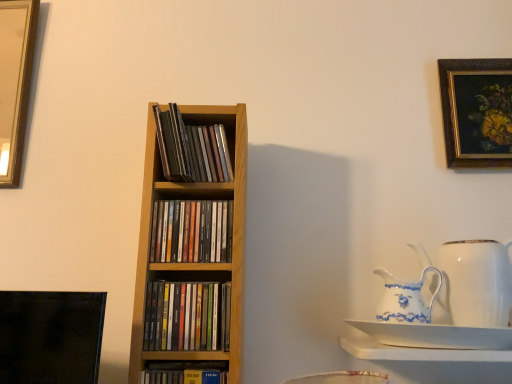
Question: In which direction should I rotate to look at wooden cd case at center, the third book in the bottom-to-top sequence?

Choices:
 (A) right
 (B) left

Answer: (B)

Question: Is multicolored paper books at center, positioned as the second book in bottom-to-top order, in front of white porcelain saucer at lower right?

Choices:
 (A) yes
 (B) no

Answer: (B)

Question: Considering the relative sizes of multicolored paper books at center, which is the 3th book in top-to-bottom order, and white porcelain saucer at lower right in the image provided, is multicolored paper books at center, which is the 3th book in top-to-bottom order, bigger than white porcelain saucer at lower right?

Choices:
 (A) yes
 (B) no

Answer: (B)

Question: Is multicolored paper books at center, positioned as the second book in bottom-to-top order, smaller than white porcelain saucer at lower right?

Choices:
 (A) no
 (B) yes

Answer: (B)

Question: Is multicolored paper books at center, which is the 3th book in top-to-bottom order, with white porcelain saucer at lower right?

Choices:
 (A) no
 (B) yes

Answer: (A)

Question: Is multicolored paper books at center, which is the 3th book in top-to-bottom order, aimed at white porcelain saucer at lower right?

Choices:
 (A) yes
 (B) no

Answer: (B)

Question: Considering the relative positions of multicolored paper books at center, which is the 3th book in top-to-bottom order, and white porcelain saucer at lower right in the image provided, is multicolored paper books at center, which is the 3th book in top-to-bottom order, to the left of white porcelain saucer at lower right from the viewer's perspective?

Choices:
 (A) no
 (B) yes

Answer: (B)

Question: Could you tell me if gold-framed painting at upper right is facing wooden cd case at center, the first book from the top?

Choices:
 (A) yes
 (B) no

Answer: (B)

Question: Is gold-framed painting at upper right in contact with wooden cd case at center, the fourth book ordered from the bottom?

Choices:
 (A) no
 (B) yes

Answer: (A)

Question: From a real-world perspective, is gold-framed painting at upper right on wooden cd case at center, the fourth book ordered from the bottom?

Choices:
 (A) yes
 (B) no

Answer: (A)

Question: Can you confirm if gold-framed painting at upper right is taller than wooden cd case at center, the fourth book ordered from the bottom?

Choices:
 (A) yes
 (B) no

Answer: (A)

Question: Is wooden cd case at center, the fourth book ordered from the bottom, located within gold-framed painting at upper right?

Choices:
 (A) no
 (B) yes

Answer: (A)

Question: Can you confirm if gold-framed painting at upper right is smaller than wooden cd case at center, the first book from the top?

Choices:
 (A) yes
 (B) no

Answer: (B)

Question: From a real-world perspective, is wooden cd case at center, the fourth book ordered from the bottom, positioned over white porcelain jug at right, the second jug viewed from the left, based on gravity?

Choices:
 (A) yes
 (B) no

Answer: (A)